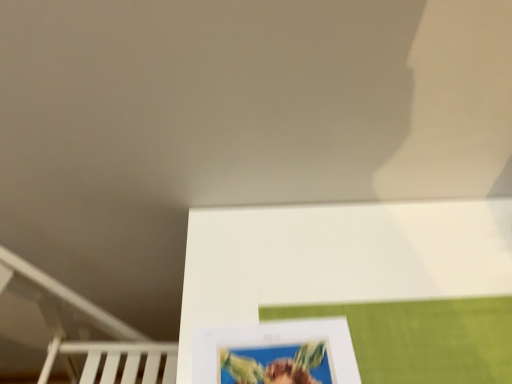
Image resolution: width=512 pixels, height=384 pixels. Describe the element at coordinates (86, 332) in the screenshot. I see `white matte bunk bed at lower left` at that location.

This screenshot has height=384, width=512. I want to click on white matte bunk bed at lower left, so click(x=86, y=332).

Measure the distance between point (113, 342) and camera.

They are 35.98 inches apart.

The image size is (512, 384). Describe the element at coordinates (277, 354) in the screenshot. I see `white matte picture frame at lower center` at that location.

Measure the distance between white matte picture frame at lower center and camera.

The distance of white matte picture frame at lower center from camera is 21.24 inches.

Where is `white matte picture frame at lower center`? Image resolution: width=512 pixels, height=384 pixels. white matte picture frame at lower center is located at coordinates (277, 354).

You are a GUI agent. You are given a task and a screenshot of the screen. Output one action in this format:
    pyautogui.click(x=<x>, y=<y>)
    Task: Click on the white matte bunk bed at lower left
    This screenshot has width=512, height=384.
    Given the screenshot: What is the action you would take?
    pyautogui.click(x=86, y=332)

Can you confirm if white matte bunk bed at lower left is positioned to the right of white matte picture frame at lower center?

No.

Which is behind, white matte bunk bed at lower left or white matte picture frame at lower center?

white matte bunk bed at lower left is behind.

Is point (19, 288) in front of point (269, 362)?

No, it is not.

From the image's perspective, is white matte bunk bed at lower left above or below white matte picture frame at lower center?

Based on their image positions, white matte bunk bed at lower left is located beneath white matte picture frame at lower center.

From a real-world perspective, is white matte bunk bed at lower left on white matte picture frame at lower center?

No, from a real-world perspective, white matte bunk bed at lower left is not on top of white matte picture frame at lower center.

Does white matte bunk bed at lower left have a lesser width compared to white matte picture frame at lower center?

No, white matte bunk bed at lower left is not thinner than white matte picture frame at lower center.

In terms of height, does white matte bunk bed at lower left look taller or shorter compared to white matte picture frame at lower center?

In the image, white matte bunk bed at lower left appears to be taller than white matte picture frame at lower center.

Is white matte bunk bed at lower left smaller than white matte picture frame at lower center?

Actually, white matte bunk bed at lower left might be larger than white matte picture frame at lower center.

Would you say white matte picture frame at lower center is part of white matte bunk bed at lower left's contents?

That's incorrect, white matte picture frame at lower center is not inside white matte bunk bed at lower left.

Is white matte bunk bed at lower left touching white matte picture frame at lower center?

No, white matte bunk bed at lower left is not touching white matte picture frame at lower center.

Does white matte bunk bed at lower left turn towards white matte picture frame at lower center?

No, white matte bunk bed at lower left does not turn towards white matte picture frame at lower center.

How many degrees apart are the facing directions of white matte bunk bed at lower left and white matte picture frame at lower center?

The angle between the facing direction of white matte bunk bed at lower left and the facing direction of white matte picture frame at lower center is 91.5 degrees.

How much distance is there between white matte bunk bed at lower left and white matte picture frame at lower center?

They are 41.39 centimeters apart.

I want to click on bunk bed directly beneath the white matte picture frame at lower center (from a real-world perspective), so click(x=86, y=332).

Is white matte picture frame at lower center to the left of white matte bunk bed at lower left from the viewer's perspective?

In fact, white matte picture frame at lower center is to the right of white matte bunk bed at lower left.

Between white matte picture frame at lower center and white matte bunk bed at lower left, which one is positioned in front?

white matte picture frame at lower center is more forward.

Which point is more forward, (332, 370) or (80, 352)?

The point (332, 370) is closer.

From the image's perspective, would you say white matte picture frame at lower center is shown under white matte bunk bed at lower left?

No, from the image's perspective, white matte picture frame at lower center is not beneath white matte bunk bed at lower left.

From a real-world perspective, is white matte picture frame at lower center beneath white matte bunk bed at lower left?

No.

Considering the sizes of white matte picture frame at lower center and white matte bunk bed at lower left in the image, is white matte picture frame at lower center wider or thinner than white matte bunk bed at lower left?

white matte picture frame at lower center is thinner than white matte bunk bed at lower left.

From their relative heights in the image, would you say white matte picture frame at lower center is taller or shorter than white matte bunk bed at lower left?

white matte picture frame at lower center is shorter than white matte bunk bed at lower left.

Does white matte picture frame at lower center have a smaller size compared to white matte bunk bed at lower left?

Yes, white matte picture frame at lower center is smaller than white matte bunk bed at lower left.

In the scene shown: Can we say white matte picture frame at lower center lies outside white matte bunk bed at lower left?

Yes, white matte picture frame at lower center is outside of white matte bunk bed at lower left.

Is white matte picture frame at lower center beside white matte bunk bed at lower left?

No, white matte picture frame at lower center is not touching white matte bunk bed at lower left.

Is white matte picture frame at lower center turned away from white matte bunk bed at lower left?

That's not correct — white matte picture frame at lower center is not looking away from white matte bunk bed at lower left.

How much distance is there between white matte picture frame at lower center and white matte bunk bed at lower left?

They are 16.29 inches apart.

Where is `bunk bed located on the left of white matte picture frame at lower center`? This screenshot has height=384, width=512. bunk bed located on the left of white matte picture frame at lower center is located at coordinates (86, 332).

This screenshot has height=384, width=512. In the image, there is a white matte bunk bed at lower left. What are the coordinates of `picture frame above it (from the image's perspective)` in the screenshot? It's located at (277, 354).

Identify the location of bunk bed located below the white matte picture frame at lower center (from the image's perspective). The width and height of the screenshot is (512, 384). (86, 332).